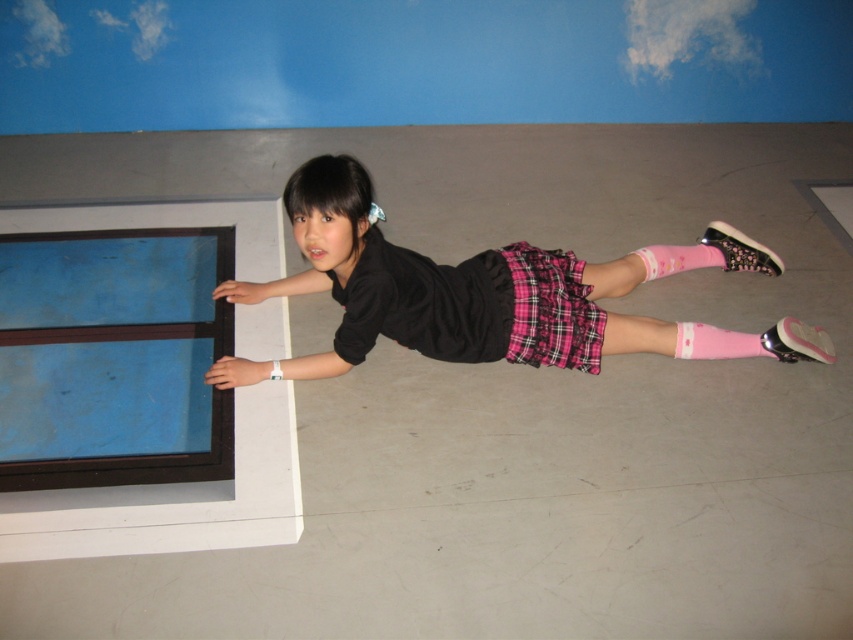
Between point (358, 355) and point (554, 364), which one is positioned behind?

The point (554, 364) is behind.

Does black matte shirt at center lie in front of plaid fabric skirt at center?

Yes, it is.

Find the location of a particular element. black matte shirt at center is located at coordinates (437, 292).

Looking at this image, does black matte shirt at center appear over pink matte sock at lower center?

Incorrect, black matte shirt at center is not positioned above pink matte sock at lower center.

Between point (229, 298) and point (663, 266), which one is positioned in front?

Positioned in front is point (229, 298).

At what (x,y) coordinates should I click in order to perform the action: click on black matte shirt at center. Please return your answer as a coordinate pair (x, y). Looking at the image, I should click on (437, 292).

Is point (689, 337) closer to camera compared to point (656, 276)?

That is True.

Does pink matte sock at lower right lie behind pink matte sock at lower center?

No, pink matte sock at lower right is closer to the viewer.

Who is more forward, (773, 355) or (640, 248)?

Point (773, 355)

At what (x,y) coordinates should I click in order to perform the action: click on pink matte sock at lower right. Please return your answer as a coordinate pair (x, y). Image resolution: width=853 pixels, height=640 pixels. Looking at the image, I should click on (715, 342).